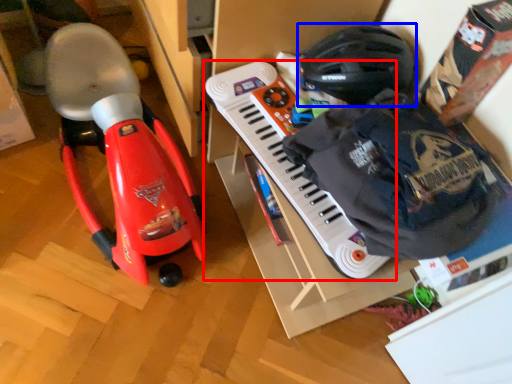
Question: Which point is closer to the camera, musical keyboard (highlighted by a red box) or helmet (highlighted by a blue box)?

Choices:
 (A) musical keyboard
 (B) helmet

Answer: (A)